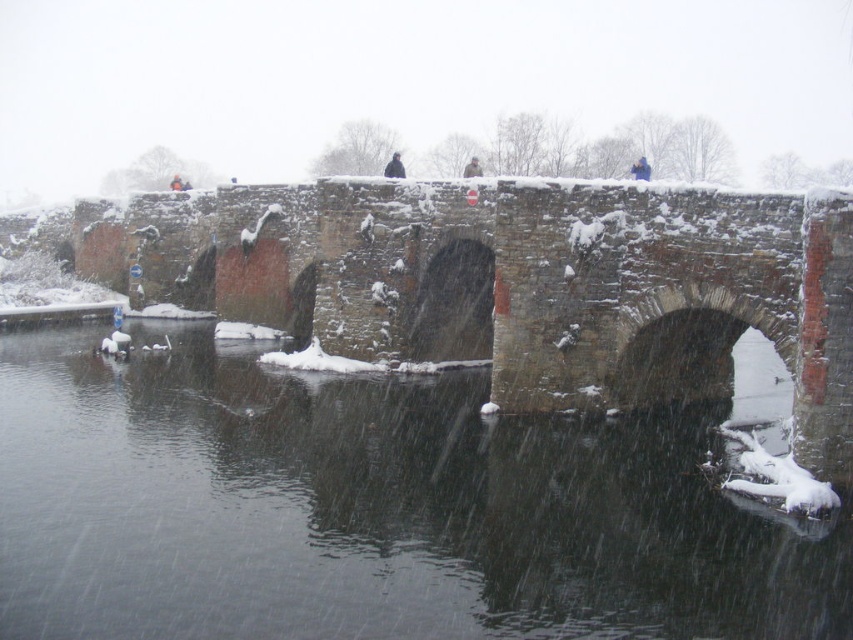
Question: Is black stone water at center smaller than blue fabric person at upper center?

Choices:
 (A) no
 (B) yes

Answer: (B)

Question: Which object appears farthest from the camera in this image?

Choices:
 (A) blue fabric person at upper center
 (B) black stone water at center
 (C) dark blue jacket at center
 (D) light brown fur coat at center

Answer: (C)

Question: Which point is closer to the camera?

Choices:
 (A) (328, 209)
 (B) (397, 161)
 (C) (479, 477)

Answer: (C)

Question: Which is nearer to the blue fabric person at upper center?

Choices:
 (A) light brown fur coat at center
 (B) dark blue jacket at center
 (C) black stone water at center
 (D) snow-covered stone bridge at center

Answer: (A)

Question: Is black stone water at center wider than snow-covered stone bridge at center?

Choices:
 (A) no
 (B) yes

Answer: (A)

Question: Considering the relative positions of black stone water at center and dark blue jacket at center in the image provided, where is black stone water at center located with respect to dark blue jacket at center?

Choices:
 (A) right
 (B) left

Answer: (A)